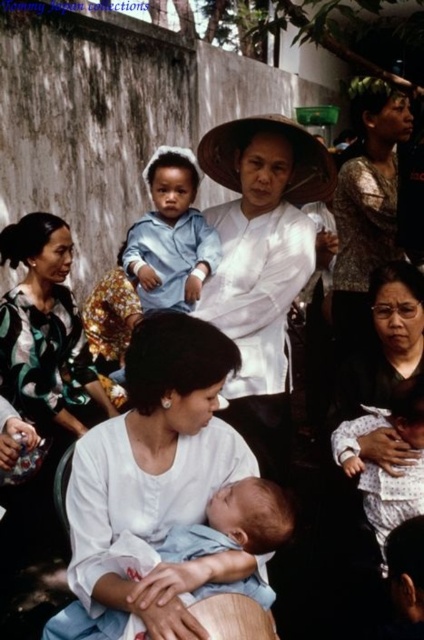
Question: Can you confirm if white matte hat at center is positioned below white cotton baby at lower right?

Choices:
 (A) no
 (B) yes

Answer: (A)

Question: Can you confirm if white cotton shirt at center is smaller than light blue fabric baby at center?

Choices:
 (A) no
 (B) yes

Answer: (A)

Question: Which of these objects is positioned closest to the white cotton shirt at center?

Choices:
 (A) light blue fabric baby at center
 (B) white cotton baby at lower right
 (C) matte black dress at center

Answer: (A)

Question: Observing the image, what is the correct spatial positioning of white matte hat at center in reference to matte blue shirt at upper left?

Choices:
 (A) below
 (B) above

Answer: (A)

Question: Which of the following is the farthest from the observer?

Choices:
 (A) white cotton shirt at center
 (B) matte black dress at center
 (C) light blue fabric baby at center

Answer: (B)

Question: Which point is closer to the camera?

Choices:
 (A) white cotton baby at lower right
 (B) matte blue shirt at upper left

Answer: (A)